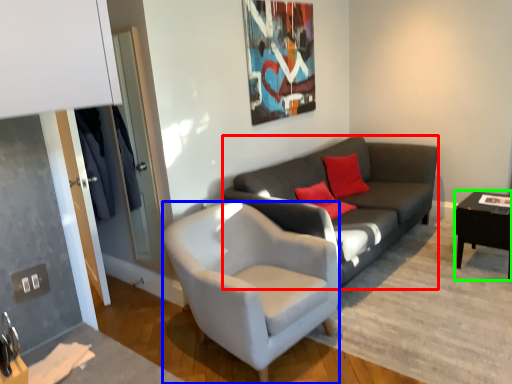
Question: Based on their relative distances, which object is farther from studio couch (highlighted by a red box)? Choose from chair (highlighted by a blue box) and table (highlighted by a green box).

Choices:
 (A) chair
 (B) table

Answer: (B)